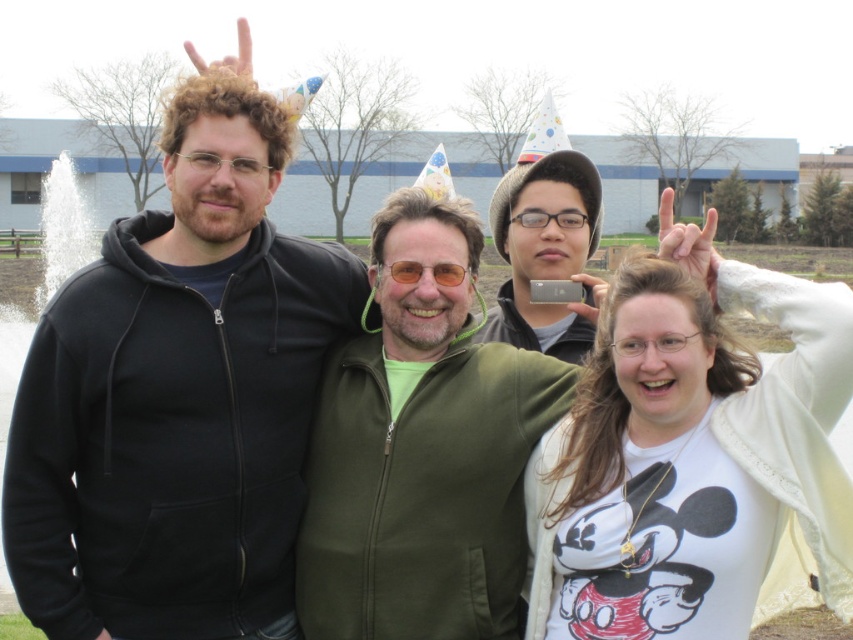
Between point (200, 150) and point (357, 476), which one is positioned in front?

Positioned in front is point (200, 150).

Which is below, black fleece jacket at left or green matte jacket at center?

green matte jacket at center

Does point (146, 228) come closer to viewer compared to point (457, 435)?

No, it is behind (457, 435).

The height and width of the screenshot is (640, 853). In order to click on black fleece jacket at left in this screenshot , I will do click(x=177, y=397).

Does white matte t-shirt at center have a greater width compared to orange reflective glasses at center?

Indeed, white matte t-shirt at center has a greater width compared to orange reflective glasses at center.

Measure the distance from white matte t-shirt at center to orange reflective glasses at center.

white matte t-shirt at center is 1.74 meters away from orange reflective glasses at center.

Describe the element at coordinates (694, 456) in the screenshot. I see `white matte t-shirt at center` at that location.

Find the location of a particular element. This screenshot has width=853, height=640. white matte t-shirt at center is located at coordinates (694, 456).

Which is above, black fleece jacket at left or orange reflective glasses at center?

orange reflective glasses at center

Between point (149, 368) and point (450, 284), which one is positioned behind?

Point (450, 284)

In order to click on black fleece jacket at left in this screenshot , I will do `click(177, 397)`.